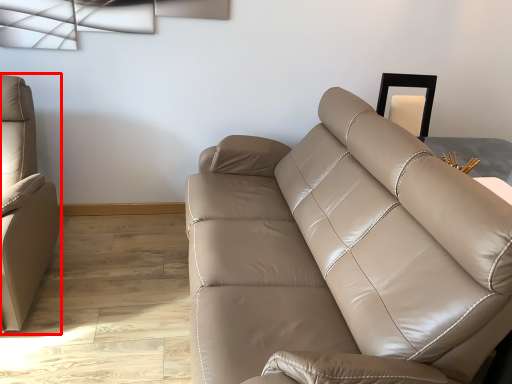
Question: From the image's perspective, what is the correct spatial positioning of studio couch (annotated by the red box) in reference to studio couch?

Choices:
 (A) above
 (B) below

Answer: (A)